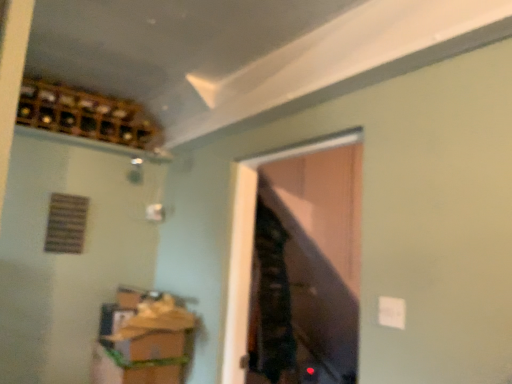
Question: Is wooden cabinet at lower left shorter than transparent glass door at center?

Choices:
 (A) no
 (B) yes

Answer: (B)

Question: Does wooden cabinet at lower left turn towards transparent glass door at center?

Choices:
 (A) yes
 (B) no

Answer: (A)

Question: From a real-world perspective, is wooden cabinet at lower left located beneath transparent glass door at center?

Choices:
 (A) yes
 (B) no

Answer: (A)

Question: Does wooden cabinet at lower left have a greater width compared to transparent glass door at center?

Choices:
 (A) no
 (B) yes

Answer: (B)

Question: Can you confirm if wooden cabinet at lower left is taller than transparent glass door at center?

Choices:
 (A) yes
 (B) no

Answer: (B)

Question: Considering the relative positions of wooden cabinet at lower left and transparent glass door at center in the image provided, is wooden cabinet at lower left in front of transparent glass door at center?

Choices:
 (A) no
 (B) yes

Answer: (A)

Question: Does transparent glass door at center appear on the left side of wooden cabinet at lower left?

Choices:
 (A) yes
 (B) no

Answer: (B)

Question: Does transparent glass door at center contain wooden cabinet at lower left?

Choices:
 (A) yes
 (B) no

Answer: (B)

Question: Can you confirm if transparent glass door at center is smaller than wooden cabinet at lower left?

Choices:
 (A) yes
 (B) no

Answer: (A)

Question: Is transparent glass door at center positioned beyond the bounds of wooden cabinet at lower left?

Choices:
 (A) no
 (B) yes

Answer: (B)

Question: From a real-world perspective, is transparent glass door at center below wooden cabinet at lower left?

Choices:
 (A) yes
 (B) no

Answer: (B)

Question: Does transparent glass door at center turn towards wooden cabinet at lower left?

Choices:
 (A) no
 (B) yes

Answer: (A)

Question: Can you confirm if wooden cabinet at lower left is smaller than wooden wine rack at upper left?

Choices:
 (A) no
 (B) yes

Answer: (A)